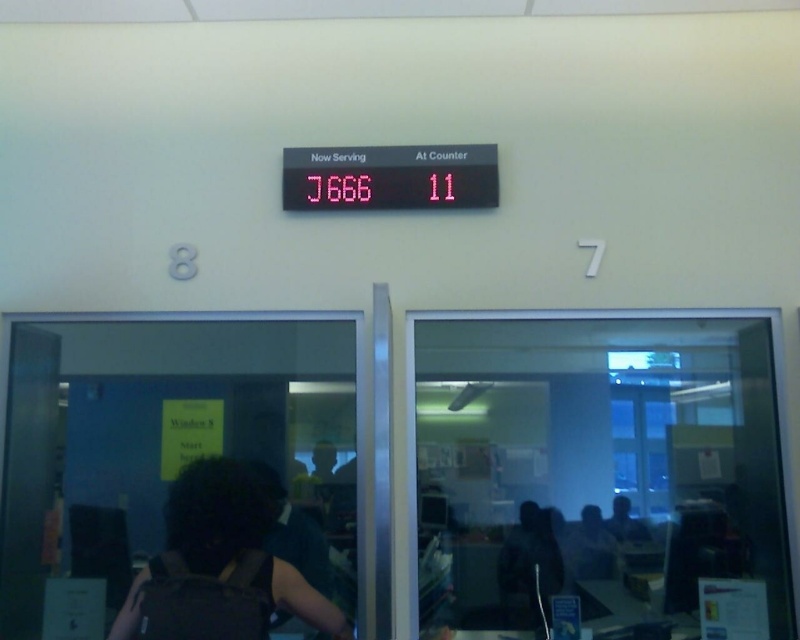
You are a delivery person standing outside the glass doors. You need to hand over a package to the person at the counter. The package is too large to fit through the gap between the transparent glass door at lower left and the black matte person at lower right. What should you do?

The transparent glass door at lower left and the black matte person at lower right are 37.05 inches apart. Since the package is too large to fit through this gap, you should enter through the glass doors and approach the black matte person at lower right directly to hand over the package.

Looking at this image, you are a delivery person standing outside the office and need to enter through one of the glass doors. The transparent glass door at right and the black matte person at lower right are in your line of sight. Which door can you use to enter?

The transparent glass door at right is taller than the black matte person at lower right, so the transparent glass door at right is the one you can use to enter.